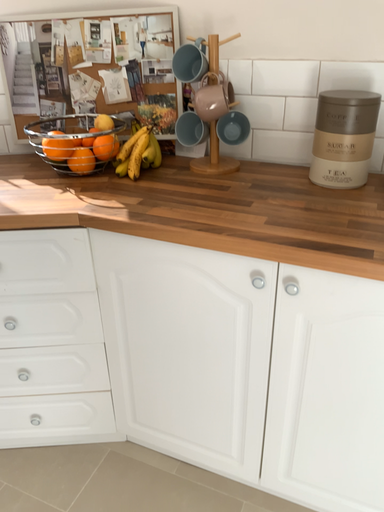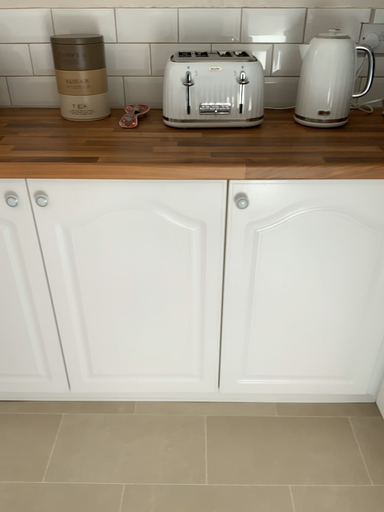
Question: How did the camera likely rotate when shooting the video?

Choices:
 (A) rotated right
 (B) rotated left

Answer: (A)